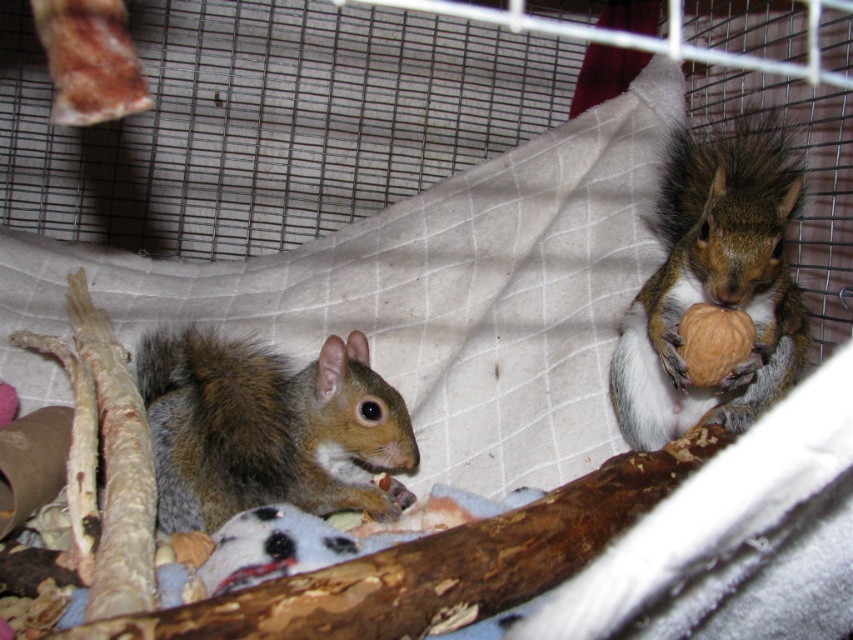
You are a wildlife photographer observing two squirrels in an enclosure. You notice a shiny brown fur at right and a brown fuzzy squirrel at center. Which of these has a thicker fur?

The brown fuzzy squirrel at center has thicker fur than the shiny brown fur at right.

You are a zookeeper who needs to feed two squirrels in an enclosure. The enclosure has a wire mesh background and a beige fabric hammock. You have a small treat in your hand. The squirrels are the shiny brown fur at right and the brown fuzzy squirrel at center. Which squirrel is closer to you so you can toss the treat to it first?

The shiny brown fur at right is closer to you than the brown fuzzy squirrel at center, so you should toss the treat to the shiny brown fur at right first since it is only 43.82 centimeters away.